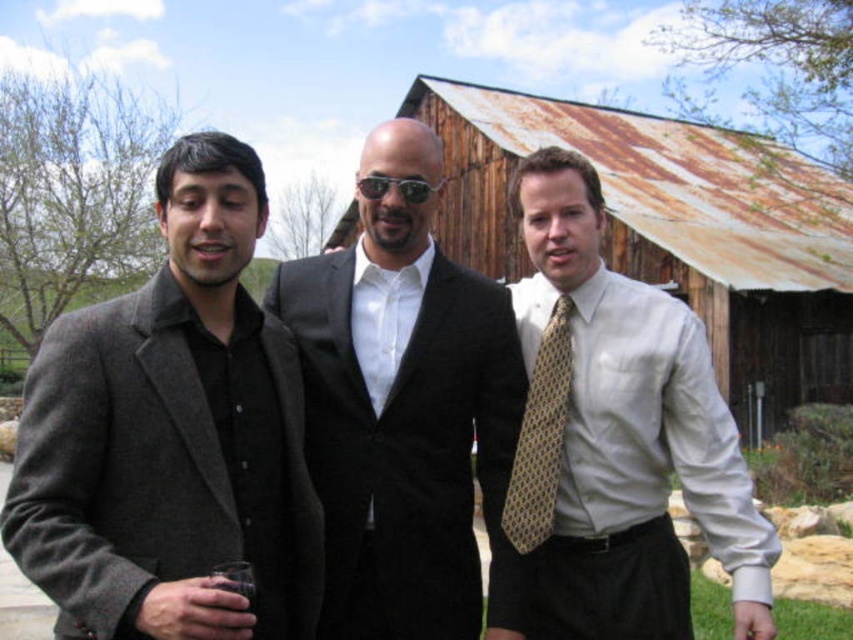
Question: Can you confirm if black satin suit at center is bigger than rusty wood hut at center?

Choices:
 (A) yes
 (B) no

Answer: (B)

Question: Based on their relative distances, which object is nearer to the rusty wood hut at center?

Choices:
 (A) matte gray blazer at left
 (B) sunglasses at center
 (C) black satin suit at center
 (D) white silk shirt at center

Answer: (D)

Question: Does matte gray blazer at left have a greater width compared to white silk shirt at center?

Choices:
 (A) yes
 (B) no

Answer: (A)

Question: Which point is closer to the camera?

Choices:
 (A) (692, 163)
 (B) (306, 308)
 (C) (427, 186)
 (D) (555, 362)

Answer: (C)

Question: In this image, where is white silk shirt at center located relative to rusty wood hut at center?

Choices:
 (A) right
 (B) left

Answer: (B)

Question: Which of the following is the farthest from the observer?

Choices:
 (A) rusty wood hut at center
 (B) yellow dotted tie at right
 (C) black satin suit at center

Answer: (A)